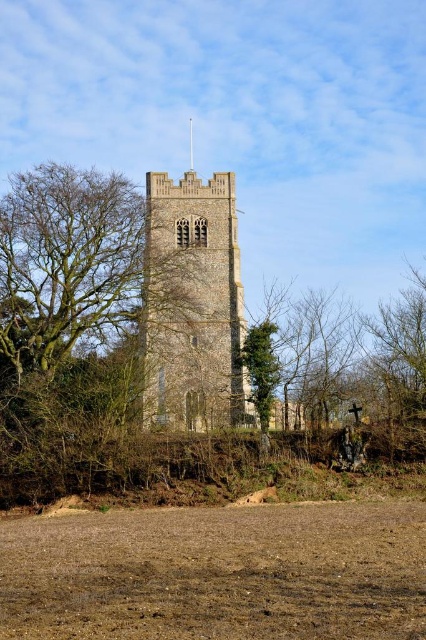
Question: Does brown soil at lower center appear on the left side of stone tower at center?

Choices:
 (A) no
 (B) yes

Answer: (A)

Question: Which of these objects is positioned farthest from the brown soil at lower center?

Choices:
 (A) green leafy tree at center
 (B) stone tower at center

Answer: (B)

Question: Is brown soil at lower center bigger than stone tower at center?

Choices:
 (A) no
 (B) yes

Answer: (B)

Question: Which object appears farthest from the camera in this image?

Choices:
 (A) brown soil at lower center
 (B) green leafy tree at center
 (C) stone tower at center

Answer: (B)

Question: Which of the following is the closest to the observer?

Choices:
 (A) (155, 584)
 (B) (169, 179)
 (C) (250, 342)

Answer: (A)

Question: Can you confirm if stone tower at center is positioned to the right of green leafy tree at center?

Choices:
 (A) no
 (B) yes

Answer: (A)